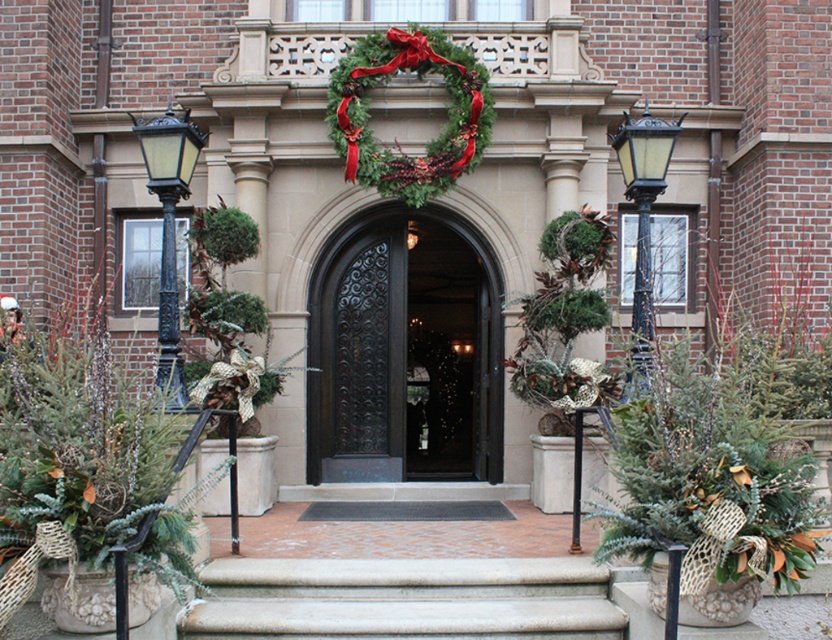
You are standing in front of the grand building entrance. You need to locate the dark polished wood door at center and the green leafy wreath at center. Which object is positioned to the right when viewed from the front?

The dark polished wood door at center is to the right of the green leafy wreath at center when viewed from the front.